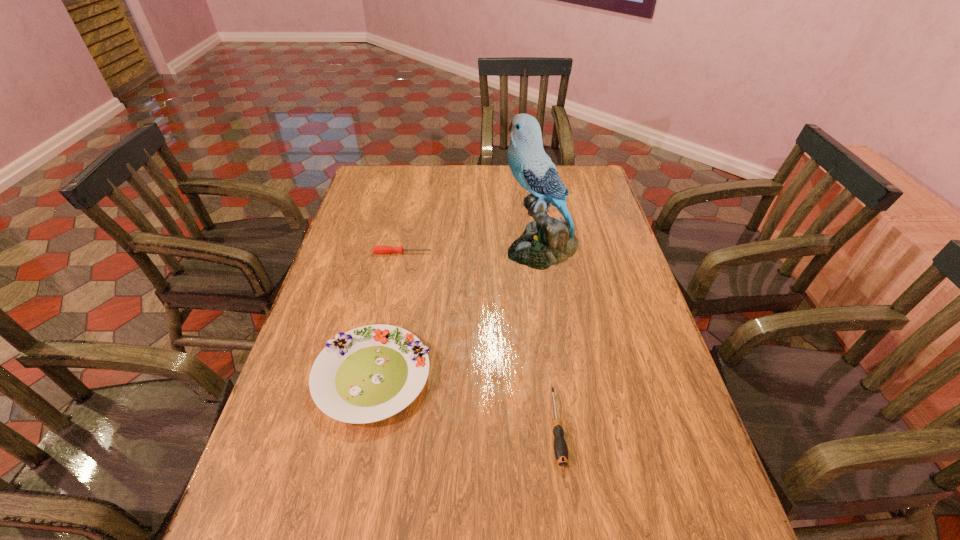
Identify the location of parakeet. The height and width of the screenshot is (540, 960). [547, 241].

Locate an element on the screen. This screenshot has width=960, height=540. salad plate is located at coordinates (368, 374).

Find the location of a particular element. The height and width of the screenshot is (540, 960). the second shortest object is located at coordinates (560, 447).

This screenshot has height=540, width=960. I want to click on the taller screwdriver, so click(560, 447).

I want to click on the farther screwdriver, so click(x=376, y=249).

Locate an element on the screen. Image resolution: width=960 pixels, height=540 pixels. the left screwdriver is located at coordinates (376, 249).

This screenshot has width=960, height=540. I want to click on blank area located on the face of the parakeet, so click(477, 249).

The width and height of the screenshot is (960, 540). What are the coordinates of `vacant area situated 0.180m on the face of the parakeet` in the screenshot? It's located at (446, 249).

Where is `free space located on the face of the parakeet`? This screenshot has width=960, height=540. free space located on the face of the parakeet is located at coordinates (406, 249).

Where is `vacant space located on the front of the second tallest object`? The image size is (960, 540). vacant space located on the front of the second tallest object is located at coordinates (339, 537).